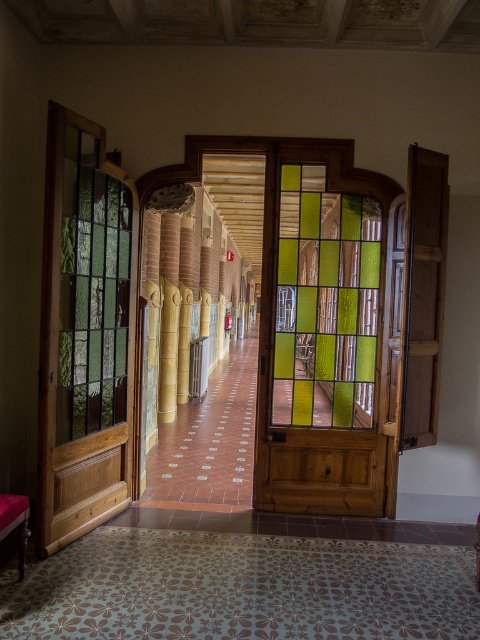
The image size is (480, 640). Describe the element at coordinates (84, 333) in the screenshot. I see `stained glass door at left` at that location.

Can you confirm if stained glass door at left is shorter than green stained glass at center?

Incorrect, stained glass door at left's height does not fall short of green stained glass at center's.

Find the location of a particular element. This screenshot has height=640, width=480. stained glass door at left is located at coordinates (84, 333).

Which is above, green stained glass at center or green stained glass at left?

green stained glass at center is above.

Who is more forward, (345, 195) or (118, 342)?

Point (118, 342) is more forward.

What are the coordinates of `green stained glass at center` in the screenshot? It's located at (324, 301).

Can you confirm if stained glass door at left is taller than green stained glass at left?

Yes.

How much distance is there between stained glass door at left and green stained glass at left?

stained glass door at left is 3.08 inches from green stained glass at left.

Which is behind, point (98, 508) or point (131, 196)?

Point (131, 196)

Identify the location of stained glass door at left. (84, 333).